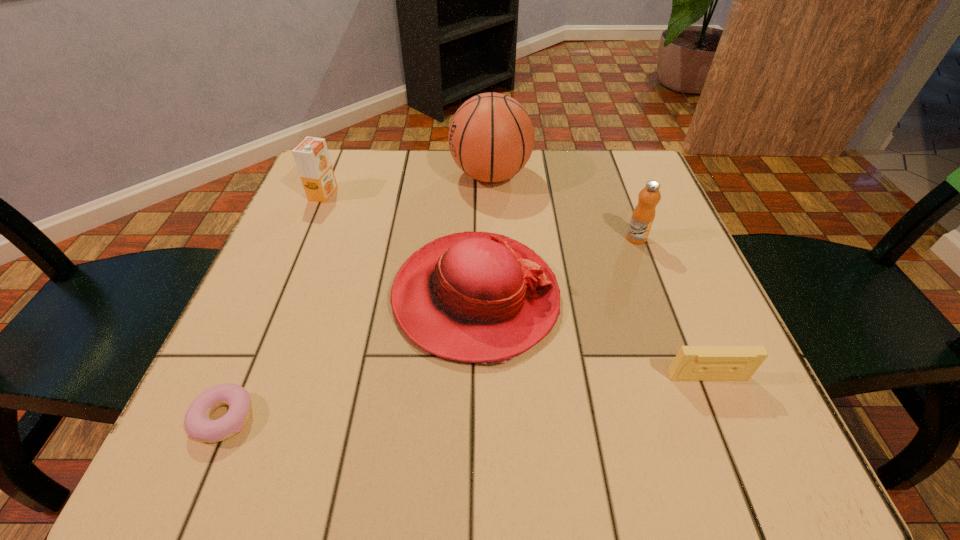
What are the coordinates of `basketball` in the screenshot? It's located at (491, 137).

Find the location of `the left orange juice`. the left orange juice is located at coordinates (311, 155).

Locate an element on the screen. This screenshot has width=960, height=540. the right orange juice is located at coordinates (643, 215).

Locate an element on the screen. The image size is (960, 540). hat is located at coordinates (477, 297).

This screenshot has width=960, height=540. I want to click on videotape, so click(692, 363).

Identify the location of the fifth tallest object. This screenshot has width=960, height=540. coord(692,363).

Locate an element on the screen. Image resolution: width=960 pixels, height=540 pixels. doughnut is located at coordinates (198, 424).

This screenshot has height=540, width=960. What are the coordinates of `the nearest object` in the screenshot? It's located at [198, 424].

Find the location of `vacant space located on the surface of the basketball near the brand logo`. vacant space located on the surface of the basketball near the brand logo is located at coordinates (316, 176).

I want to click on vacant space located on the surface of the basketball near the brand logo, so click(308, 176).